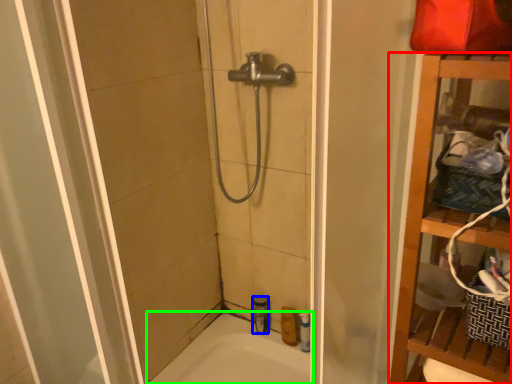
Question: Which object is the closest to the furniture (highlighted by a red box)? Choose among these: toiletry (highlighted by a blue box) or bathtub (highlighted by a green box).

Choices:
 (A) toiletry
 (B) bathtub

Answer: (B)